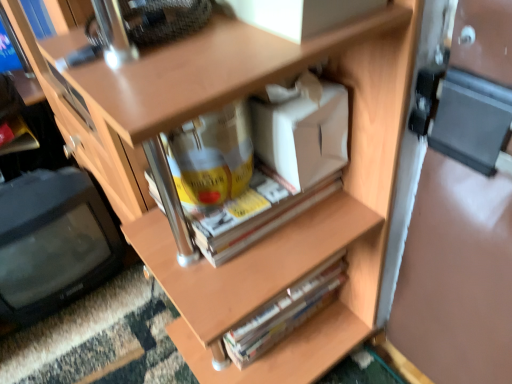
Question: From the image's perspective, is white cardboard box at center above black plastic computer monitor at left?

Choices:
 (A) no
 (B) yes

Answer: (B)

Question: Is white cardboard box at center oriented away from black plastic computer monitor at left?

Choices:
 (A) yes
 (B) no

Answer: (B)

Question: Is white cardboard box at center positioned behind black plastic computer monitor at left?

Choices:
 (A) yes
 (B) no

Answer: (B)

Question: Is white cardboard box at center positioned beyond the bounds of black plastic computer monitor at left?

Choices:
 (A) yes
 (B) no

Answer: (A)

Question: Is white cardboard box at center placed right next to black plastic computer monitor at left?

Choices:
 (A) no
 (B) yes

Answer: (A)

Question: Is white cardboard box at center positioned in front of black plastic computer monitor at left?

Choices:
 (A) yes
 (B) no

Answer: (A)

Question: Can you confirm if black plastic computer monitor at left is taller than hardcover book at center?

Choices:
 (A) yes
 (B) no

Answer: (A)

Question: Does black plastic computer monitor at left have a larger size compared to hardcover book at center?

Choices:
 (A) yes
 (B) no

Answer: (A)

Question: From the image's perspective, is black plastic computer monitor at left over hardcover book at center?

Choices:
 (A) yes
 (B) no

Answer: (A)

Question: Considering the relative sizes of black plastic computer monitor at left and hardcover book at center in the image provided, is black plastic computer monitor at left smaller than hardcover book at center?

Choices:
 (A) yes
 (B) no

Answer: (B)

Question: Is black plastic computer monitor at left facing away from hardcover book at center?

Choices:
 (A) no
 (B) yes

Answer: (A)

Question: Can you confirm if black plastic computer monitor at left is positioned to the right of hardcover book at center?

Choices:
 (A) no
 (B) yes

Answer: (A)

Question: Can you confirm if black plastic computer monitor at left is wider than white cardboard box at center?

Choices:
 (A) yes
 (B) no

Answer: (A)